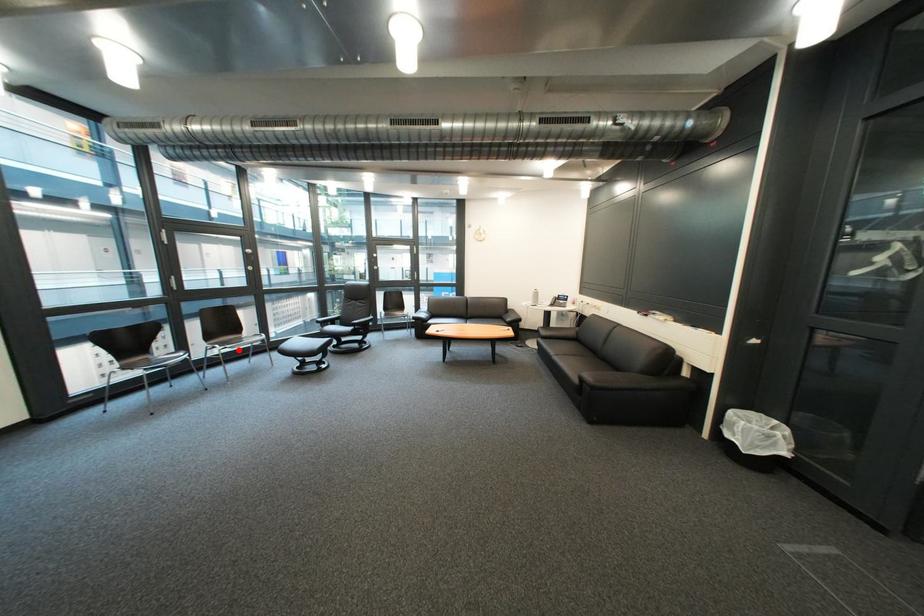
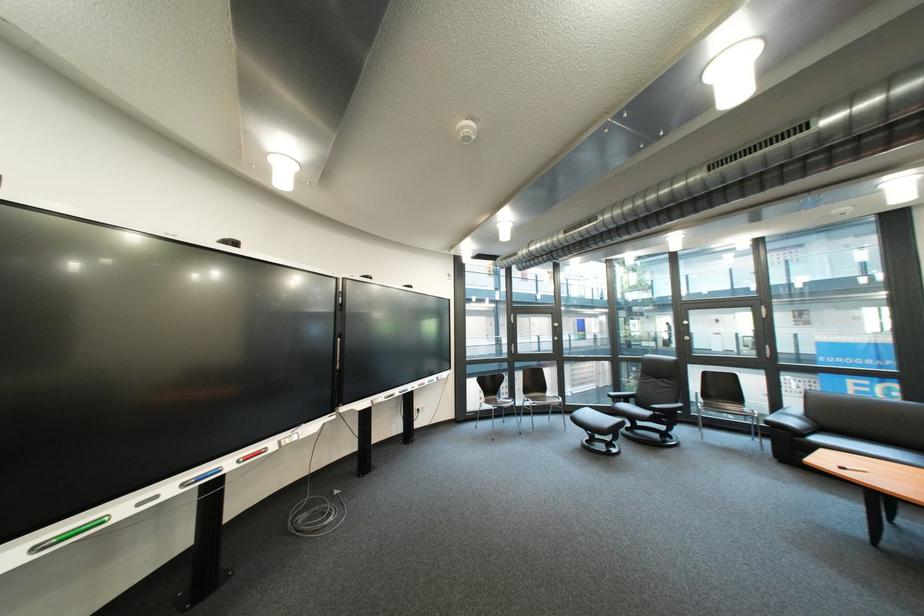
Question: A red point is marked in image1. In image2, is the corresponding 3D point closer to the camera or farther? Reply with the corresponding letter.

Choices:
 (A) The corresponding 3D point is closer.
 (B) The corresponding 3D point is farther.

Answer: (B)